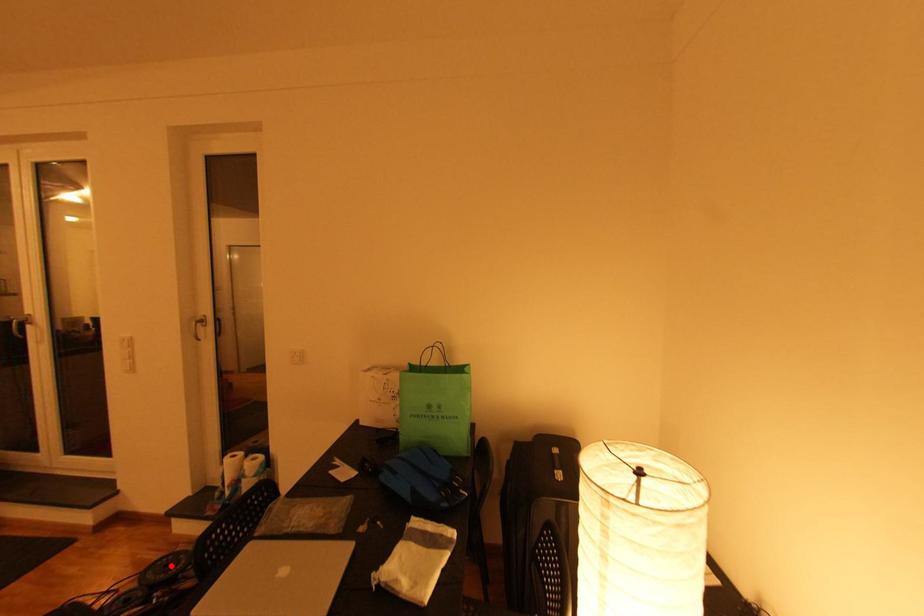
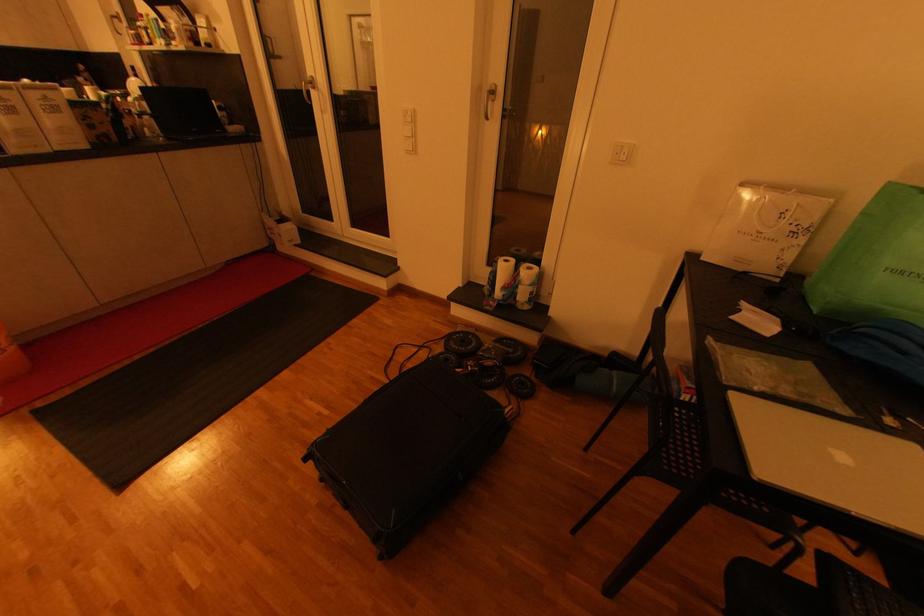
The point at the highlighted location is marked in the first image. Where is the corresponding point in the second image?

(468, 342)